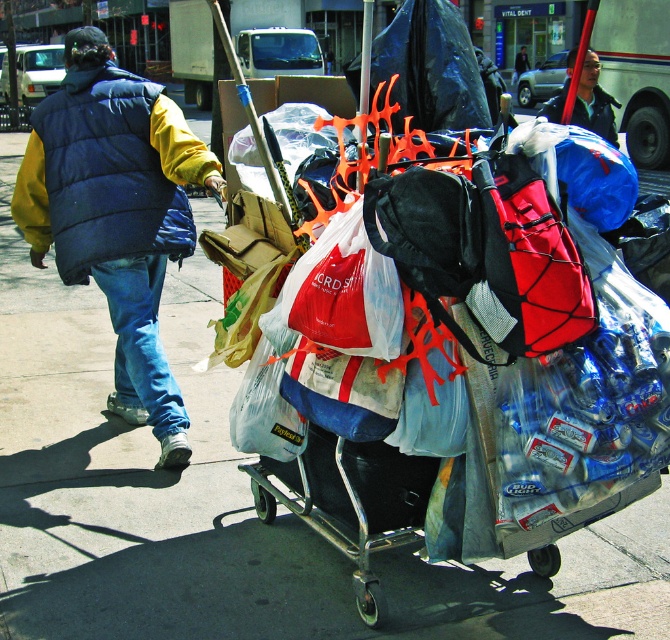
Question: Is blue puffy vest at left to the left of blue puffy vest at upper left from the viewer's perspective?

Choices:
 (A) yes
 (B) no

Answer: (A)

Question: Is blue puffy vest at upper left thinner than dark blue jacket at center?

Choices:
 (A) no
 (B) yes

Answer: (B)

Question: Which object appears closest to the camera in this image?

Choices:
 (A) blue puffy vest at upper left
 (B) blue puffy vest at left

Answer: (B)

Question: Which point is closer to the camera?

Choices:
 (A) dark blue jacket at center
 (B) blue puffy vest at left
 (C) blue puffy vest at upper left

Answer: (B)

Question: Observing the image, what is the correct spatial positioning of blue puffy vest at upper left in reference to dark blue jacket at center?

Choices:
 (A) above
 (B) below

Answer: (B)

Question: Among these objects, which one is farthest from the camera?

Choices:
 (A) blue puffy vest at upper left
 (B) blue puffy vest at left
 (C) dark blue jacket at center

Answer: (C)